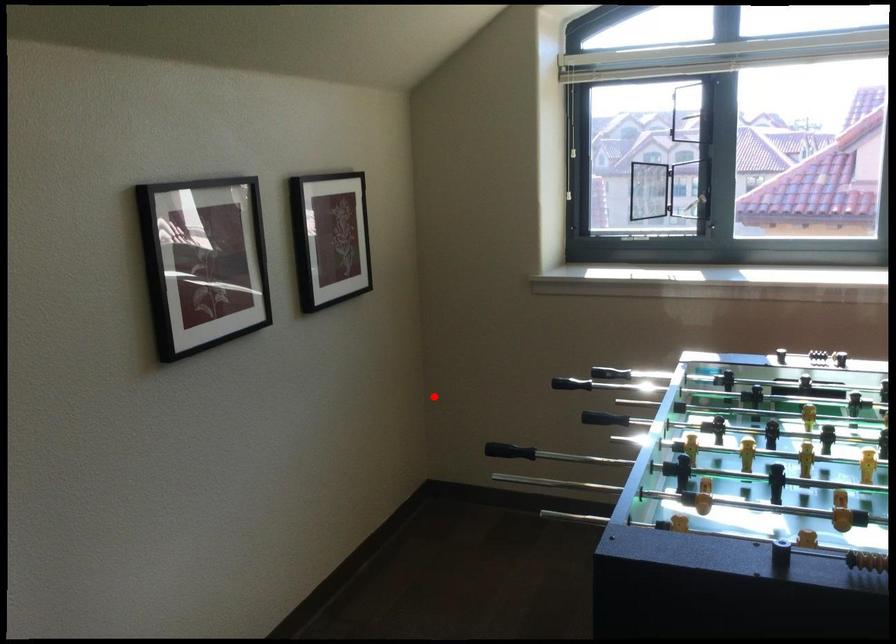
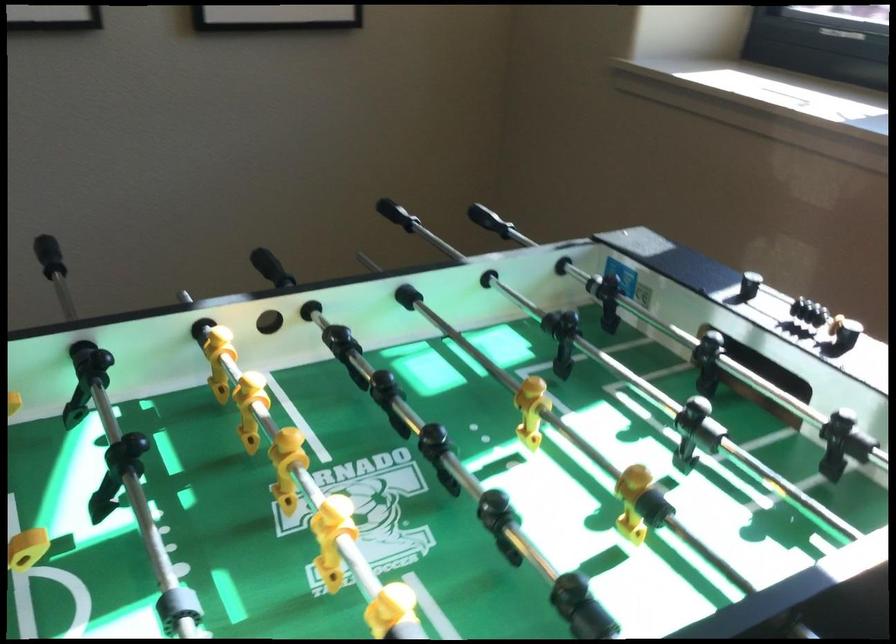
Question: I am providing you with two images of the same scene from different viewpoints. In image1, a red point is highlighted. Considering the same 3D point in image2, which of the following is correct?

Choices:
 (A) It is closer
 (B) It is farther

Answer: (A)